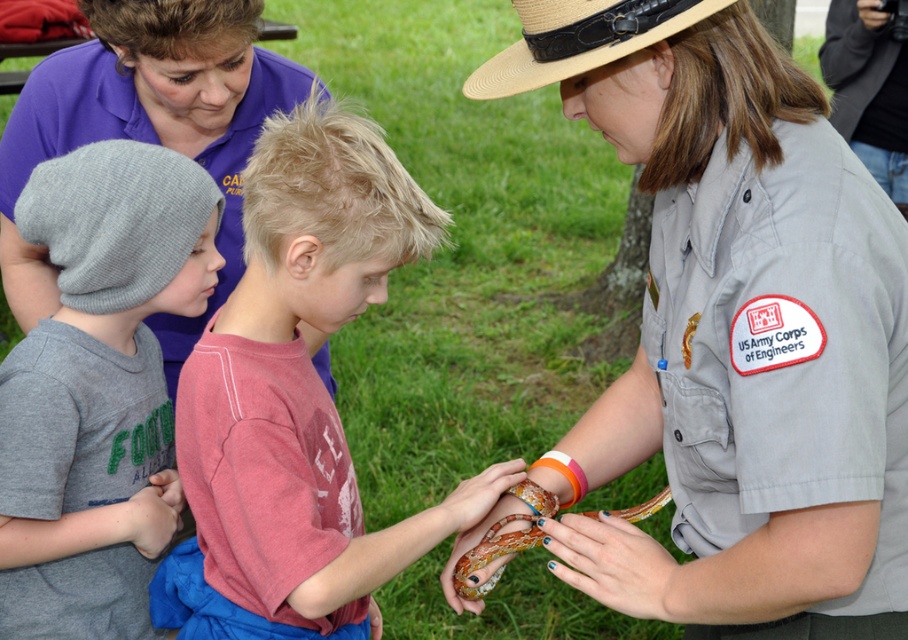
Question: Can you confirm if matte purple shirt at upper left is thinner than straw hat at upper center?

Choices:
 (A) no
 (B) yes

Answer: (A)

Question: Estimate the real-world distances between objects in this image. Which object is closer to the gray uniform at center?

Choices:
 (A) matte purple shirt at upper left
 (B) knit gray beanie at left

Answer: (B)

Question: Which of the following is the farthest from the observer?

Choices:
 (A) knit gray beanie at left
 (B) multicolored scales snake at center

Answer: (A)

Question: Is matte red shirt at center above matte purple shirt at upper left?

Choices:
 (A) no
 (B) yes

Answer: (A)

Question: Which of the following is the farthest from the observer?

Choices:
 (A) multicolored painted nails at center
 (B) straw hat at upper center

Answer: (B)

Question: From the image, what is the correct spatial relationship of matte purple shirt at upper left in relation to multicolored scales snake at center?

Choices:
 (A) above
 (B) below

Answer: (A)